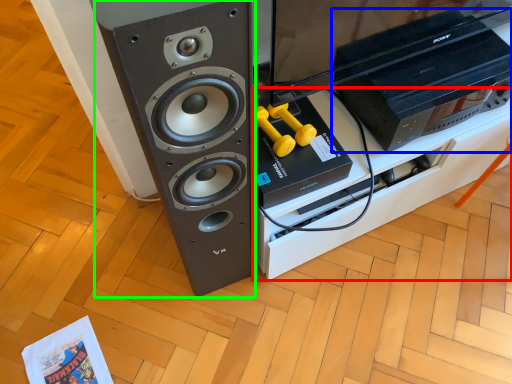
Question: Which object is positioned closest to furniture (highlighted by a red box)? Select from home appliance (highlighted by a blue box) and speaker (highlighted by a green box).

Choices:
 (A) home appliance
 (B) speaker

Answer: (A)